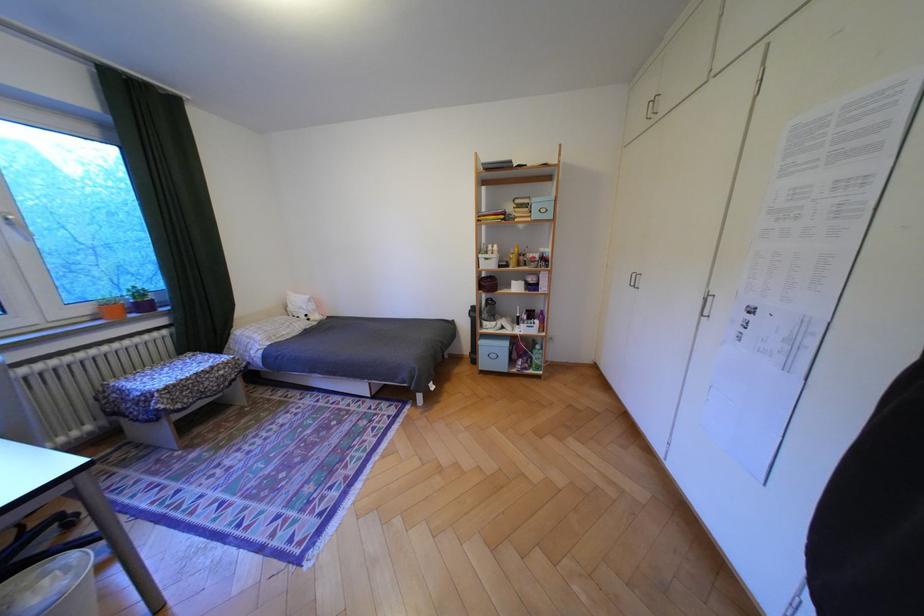
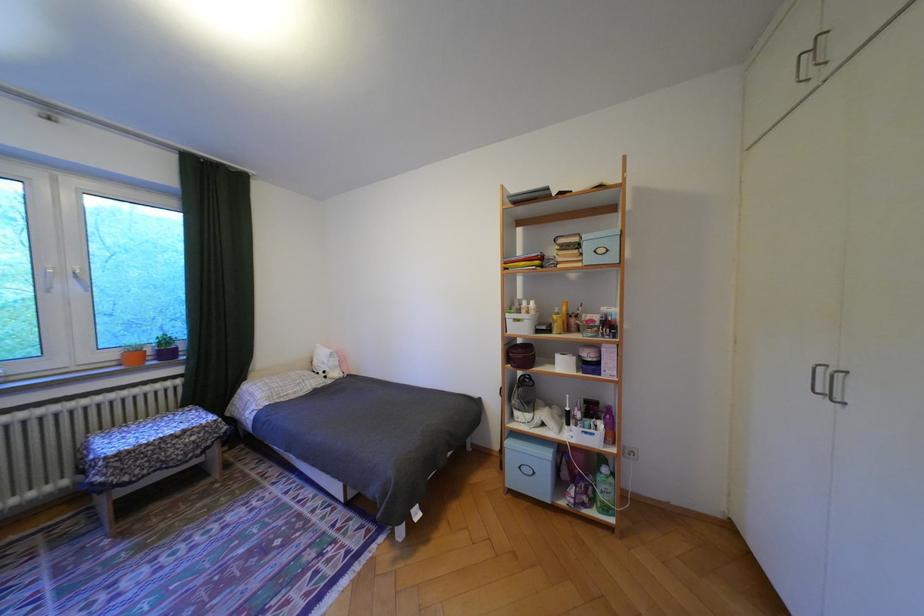
Find the pixel in the second image that matches the point at 495,363 in the first image.

(525, 479)